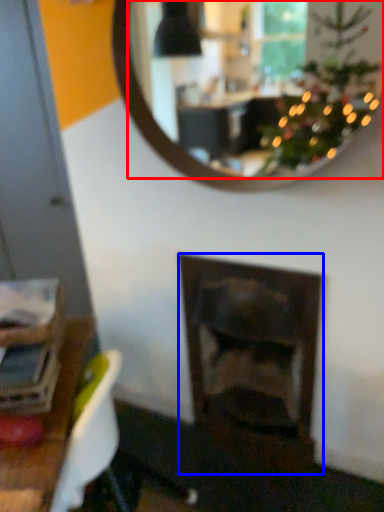
Question: Which object appears closest to the camera in this image, mirror (highlighted by a red box) or fireplace (highlighted by a blue box)?

Choices:
 (A) mirror
 (B) fireplace

Answer: (A)